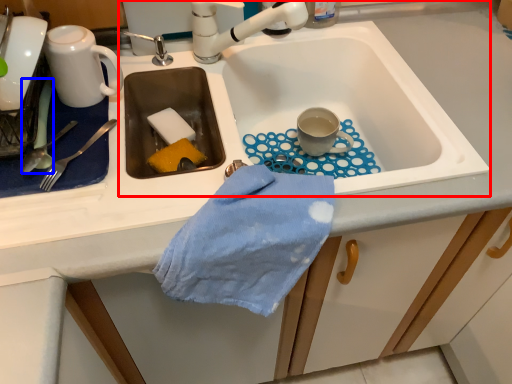
Question: Which object appears closest to the camera in this image, sink (highlighted by a red box) or silverware (highlighted by a blue box)?

Choices:
 (A) sink
 (B) silverware

Answer: (A)